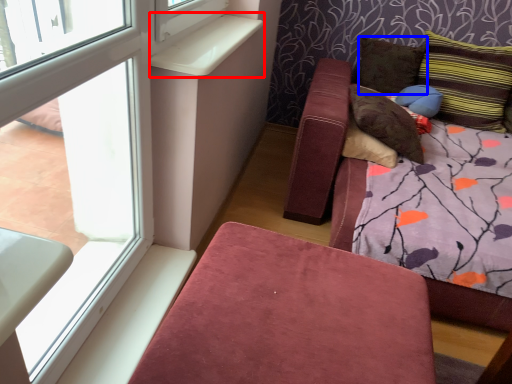
Question: Which object appears closest to the camera in this image, window sill (highlighted by a red box) or pillow (highlighted by a blue box)?

Choices:
 (A) window sill
 (B) pillow

Answer: (A)